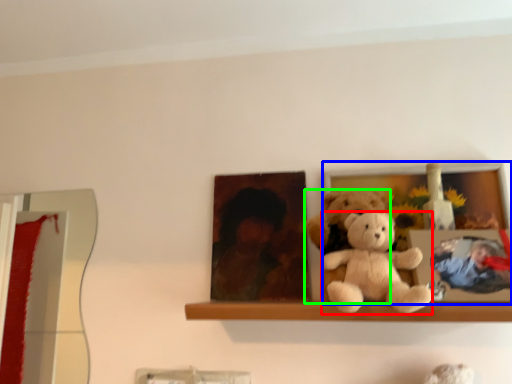
Question: Estimate the real-world distances between objects in this image. Which object is farther from teddy bear (highlighted by a red box), picture frame (highlighted by a blue box) or teddy bear (highlighted by a green box)?

Choices:
 (A) picture frame
 (B) teddy bear

Answer: (A)